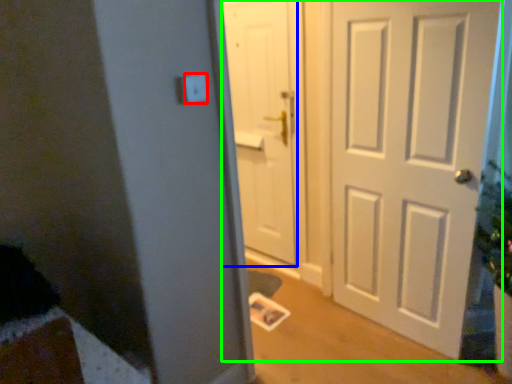
Question: Estimate the real-world distances between objects in this image. Which object is closer to light switch (highlighted by a red box), door (highlighted by a blue box) or door (highlighted by a green box)?

Choices:
 (A) door
 (B) door

Answer: (B)